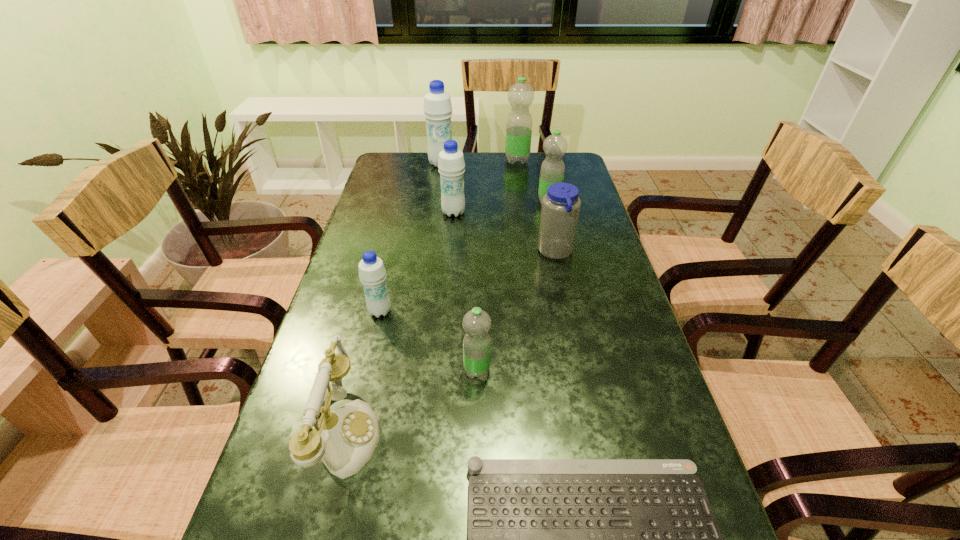
Where is `vacant space located 0.300m on the right of the sixth farthest water bottle`? vacant space located 0.300m on the right of the sixth farthest water bottle is located at coordinates (516, 312).

Where is `vacant point located 0.170m on the right of the nearest green water bottle`? The image size is (960, 540). vacant point located 0.170m on the right of the nearest green water bottle is located at coordinates (570, 370).

Find the location of a particular element. vacant space located on the dial of the telephone is located at coordinates (551, 433).

You are a GUI agent. You are given a task and a screenshot of the screen. Output one action in this format:
    pyautogui.click(x=<x>, y=<y>)
    Task: Click on the water bottle that is at the left edge
    
    Given the screenshot: What is the action you would take?
    pyautogui.click(x=372, y=273)

Find the location of a particular element. Image resolution: width=960 pixels, height=540 pixels. telephone that is positioned at the left edge is located at coordinates (345, 439).

Locate an element on the screen. The image size is (960, 540). vacant space at the far edge is located at coordinates (483, 168).

This screenshot has width=960, height=540. In the image, there is a desktop. In order to click on vacant space at the left edge in this screenshot , I will do pos(352,272).

Identify the location of vacant area at the right edge. The image size is (960, 540). (623, 333).

Find the location of a particular element. This screenshot has height=540, width=960. vacant space at the far left corner of the desktop is located at coordinates (411, 161).

I want to click on free space at the far right corner, so click(581, 167).